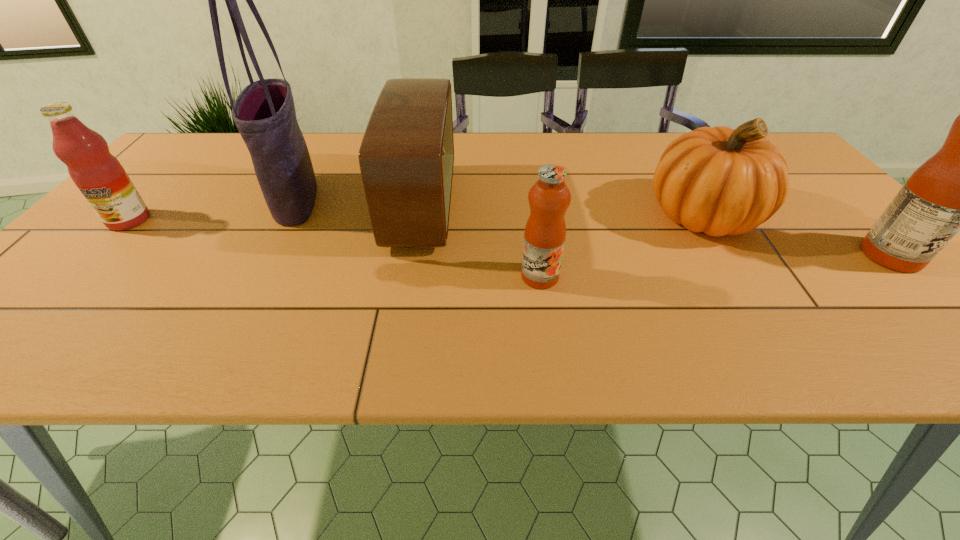
Locate an element on the screen. The height and width of the screenshot is (540, 960). vacant region located on the left of the tallest object is located at coordinates pos(197,199).

Find the location of a particular element. blank space located on the front-facing side of the fourth object from right to left is located at coordinates (516, 207).

The width and height of the screenshot is (960, 540). What are the coordinates of `free region located 0.090m on the label of the leftmost fruit juice` in the screenshot? It's located at tap(93, 258).

I want to click on object that is at the far edge, so click(406, 157).

Find the location of a particular element. object present at the near edge is located at coordinates (549, 197).

The height and width of the screenshot is (540, 960). Identify the location of object that is positioned at the left edge. (100, 177).

The height and width of the screenshot is (540, 960). What are the coordinates of `object situated at the right edge` in the screenshot? It's located at (959, 188).

The height and width of the screenshot is (540, 960). In the image, there is a desktop. Find the location of `vacant space at the far edge`. vacant space at the far edge is located at coordinates (648, 167).

Where is `blank area at the near edge`? This screenshot has height=540, width=960. blank area at the near edge is located at coordinates (488, 309).

Locate an element on the screen. Image resolution: width=960 pixels, height=540 pixels. vacant space at the left edge of the desktop is located at coordinates (132, 244).